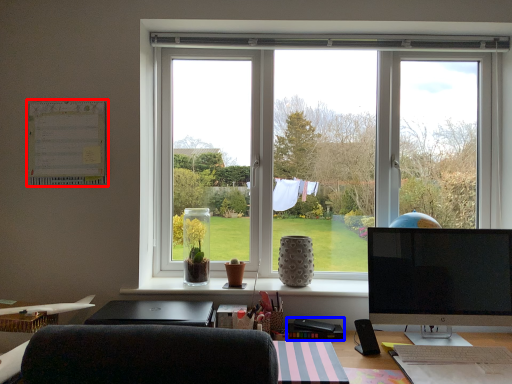
Question: Which of the following is the closest to the observer, bulletin board (highlighted by a red box) or stationery (highlighted by a blue box)?

Choices:
 (A) bulletin board
 (B) stationery

Answer: (B)